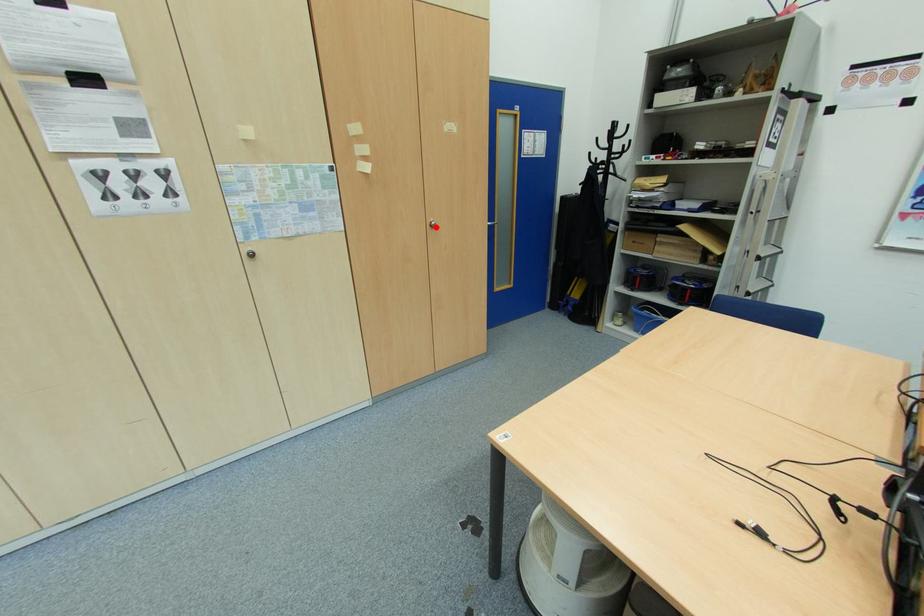
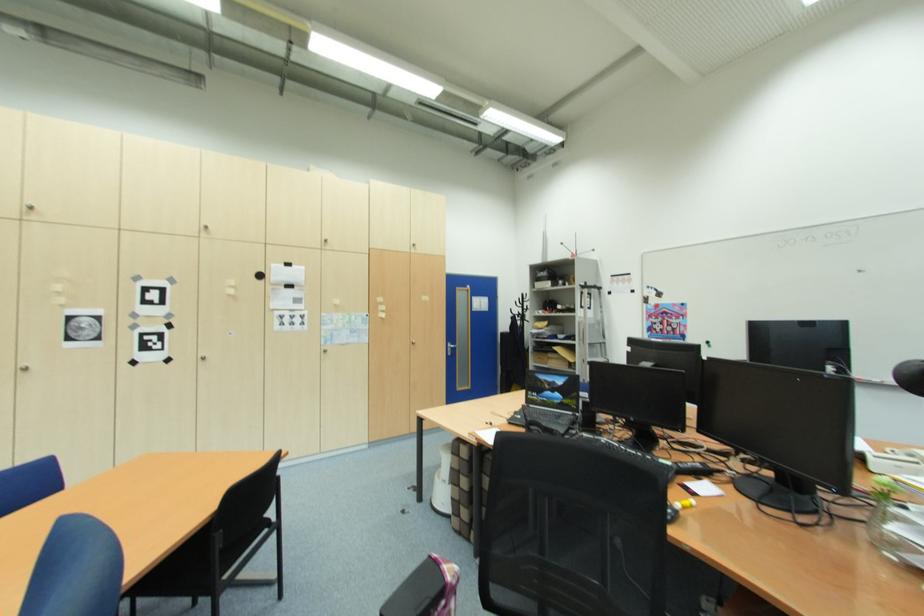
Locate, in the second image, the point that corresponds to the highlighted location in the first image.

(418, 345)